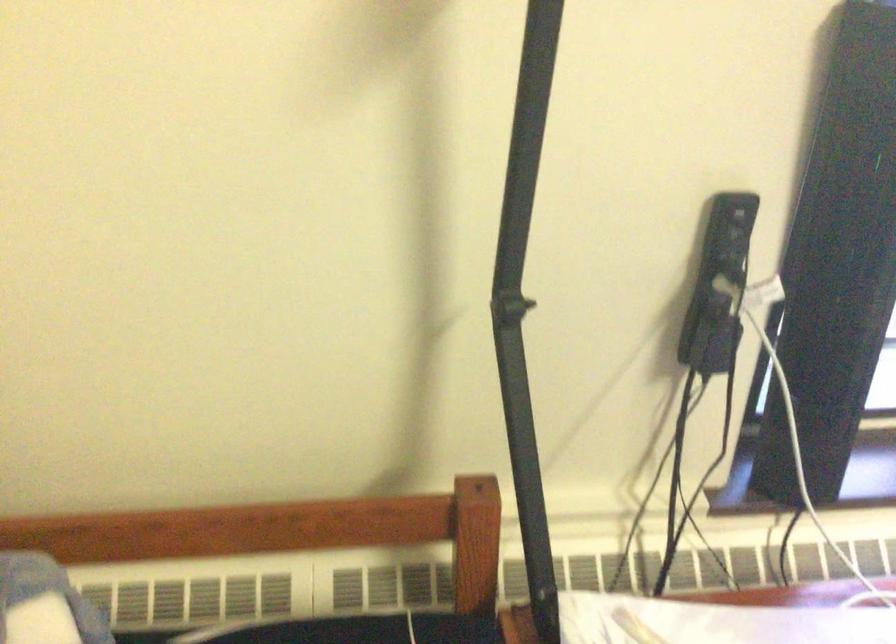
The width and height of the screenshot is (896, 644). Describe the element at coordinates (524, 305) in the screenshot. I see `a black lamp joint` at that location.